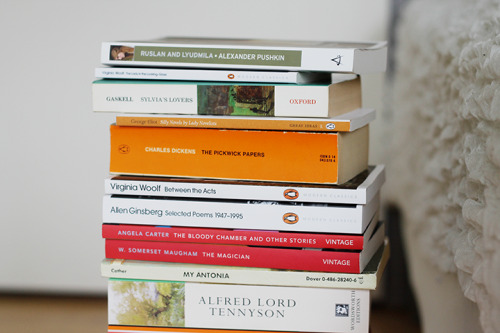
Locate an element on the screen. This screenshot has width=500, height=333. bottom of book is located at coordinates (370, 59), (304, 76), (348, 95), (361, 119), (376, 183), (370, 207), (371, 226), (377, 239), (382, 264).